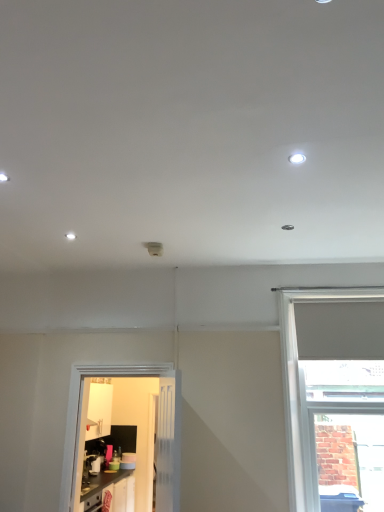
Question: Is white glossy door at lower left surrounded by white glossy light fixture at upper right?

Choices:
 (A) yes
 (B) no

Answer: (B)

Question: Is white glossy light fixture at upper right aimed at white glossy door at lower left?

Choices:
 (A) yes
 (B) no

Answer: (B)

Question: Is white glossy light fixture at upper right turned away from white glossy door at lower left?

Choices:
 (A) yes
 (B) no

Answer: (B)

Question: Is the surface of white glossy light fixture at upper right in direct contact with white glossy door at lower left?

Choices:
 (A) yes
 (B) no

Answer: (B)

Question: Considering the relative sizes of white glossy light fixture at upper right and white glossy door at lower left in the image provided, is white glossy light fixture at upper right shorter than white glossy door at lower left?

Choices:
 (A) no
 (B) yes

Answer: (B)

Question: Is white glossy light fixture at upper right outside white glossy door at lower left?

Choices:
 (A) no
 (B) yes

Answer: (B)

Question: Is white glossy light fixture at upper right positioned far away from matte black cabinets at lower left?

Choices:
 (A) yes
 (B) no

Answer: (A)

Question: Does white glossy light fixture at upper right contain matte black cabinets at lower left?

Choices:
 (A) no
 (B) yes

Answer: (A)

Question: From the image's perspective, is white glossy light fixture at upper right beneath matte black cabinets at lower left?

Choices:
 (A) yes
 (B) no

Answer: (B)

Question: Is white glossy light fixture at upper right aimed at matte black cabinets at lower left?

Choices:
 (A) no
 (B) yes

Answer: (A)

Question: Is white glossy light fixture at upper right at the right side of matte black cabinets at lower left?

Choices:
 (A) no
 (B) yes

Answer: (B)

Question: Is white glossy light fixture at upper right shorter than matte black cabinets at lower left?

Choices:
 (A) yes
 (B) no

Answer: (A)

Question: Can you confirm if matte black cabinets at lower left is shorter than white glossy door at lower left?

Choices:
 (A) no
 (B) yes

Answer: (B)